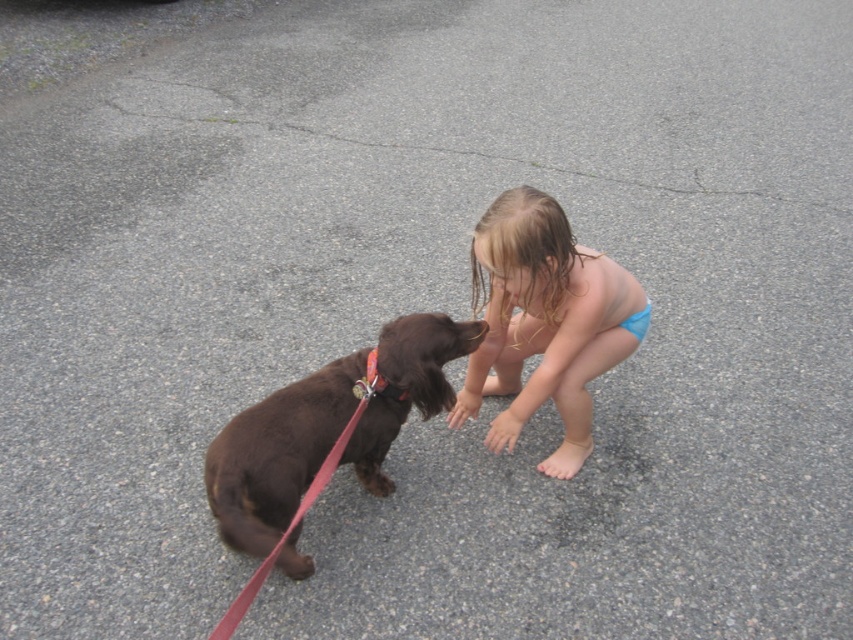
You are a photographer trying to capture a closeup shot of the shiny brown dog at center and the blue fabric bikini at center. Since you want both subjects to be in focus, which one should you focus on first to ensure proper depth of field?

You should focus on the shiny brown dog at center first because it is larger in size compared to the blue fabric bikini at center, so it requires more precise focus to capture details.

The child in the blue fabric bikini at center wants to move closer to the shiny brown dog at center. Which direction should they move to get closer?

The shiny brown dog at center is positioned on the left side of blue fabric bikini at center, so the child should move to the left to get closer.

The child in the blue fabric bikini at center wants to walk the shiny brown dog at center. If the dog is wider than the bikini, will the leash be long enough for the dog to move freely without dragging the bikini?

The shiny brown dog at center is wider than the blue fabric bikini at center. However, the leash length isn not mentioned in the provided information, so we cannot determine if it will be long enough for the dog to move freely without dragging the bikini.